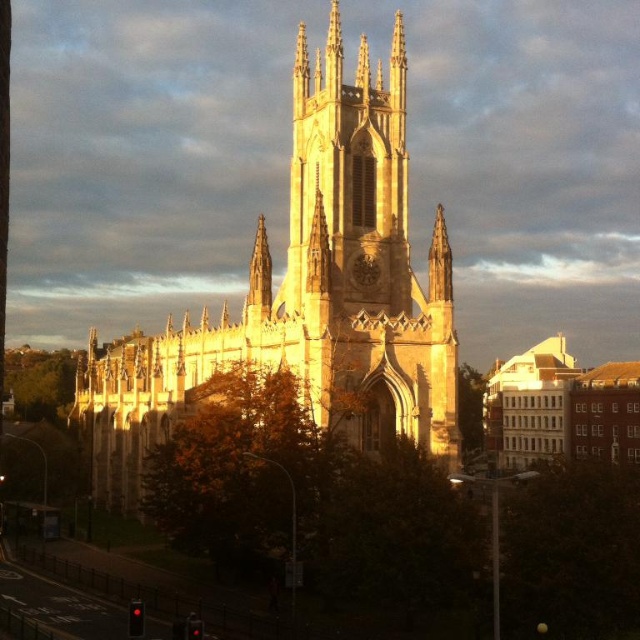
Can you confirm if golden stone church at center is thinner than light brown stone church at center?

Incorrect, golden stone church at center's width is not less than light brown stone church at center's.

How much distance is there between golden stone church at center and light brown stone church at center?

The distance of golden stone church at center from light brown stone church at center is 119.79 feet.

The width and height of the screenshot is (640, 640). Describe the element at coordinates (308, 292) in the screenshot. I see `golden stone church at center` at that location.

I want to click on golden stone church at center, so click(x=308, y=292).